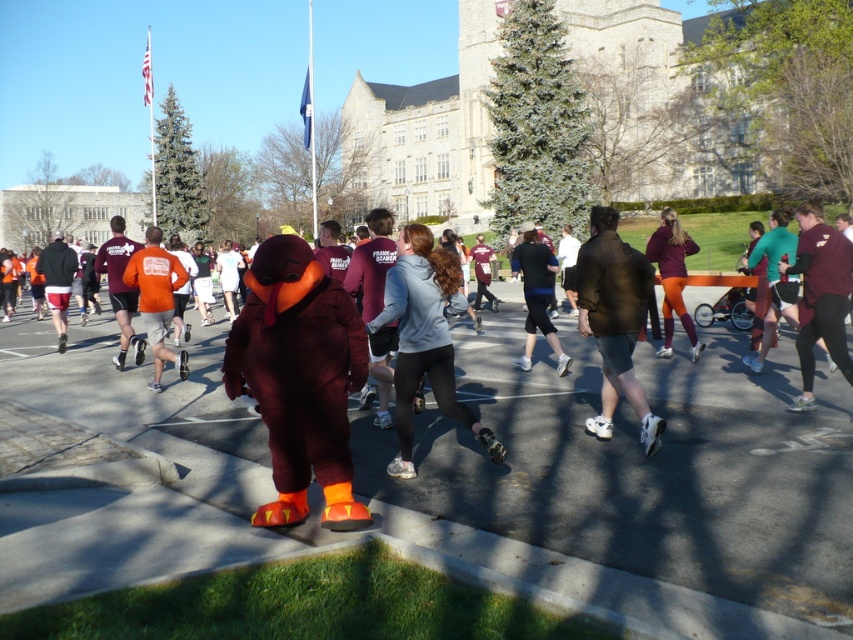
Question: Observing the image, what is the correct spatial positioning of smooth asphalt road at center in reference to dark gray leggings at center?

Choices:
 (A) below
 (B) above

Answer: (A)

Question: Which is nearer to the orange fabric turkey at center?

Choices:
 (A) dark brown shorts at center
 (B) smooth asphalt road at center
 (C) maroon fabric turkey at center
 (D) gray matte hoodie at center

Answer: (B)

Question: Which of the following is the farthest from the observer?

Choices:
 (A) maroon fabric pants at center
 (B) gray matte hoodie at center

Answer: (A)

Question: From the image, what is the correct spatial relationship of maroon fabric turkey at center in relation to dark brown shorts at center?

Choices:
 (A) left
 (B) right

Answer: (A)

Question: Does maroon jersey at right have a smaller size compared to dark gray leggings at center?

Choices:
 (A) no
 (B) yes

Answer: (B)

Question: Among these points, which one is nearest to the camera?

Choices:
 (A) (779, 426)
 (B) (701, 342)
 (C) (525, 321)

Answer: (A)